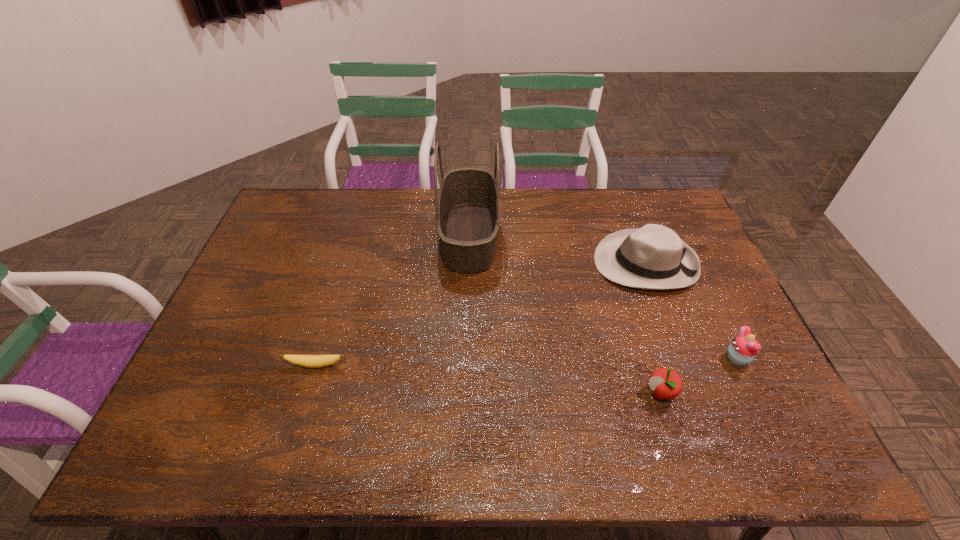
Find the location of a particular element. This screenshot has height=540, width=960. free region at the near edge of the desktop is located at coordinates (378, 439).

Where is `free location at the left edge of the desktop`? free location at the left edge of the desktop is located at coordinates (278, 237).

Where is `free region at the right edge of the desktop`? This screenshot has height=540, width=960. free region at the right edge of the desktop is located at coordinates (735, 409).

Identify the location of free space at the far left corner of the desktop. click(x=301, y=211).

In the image, there is a desktop. At what (x,y) coordinates should I click in order to perform the action: click on blank space at the far right corner. Please return your answer as a coordinate pair (x, y). Image resolution: width=960 pixels, height=540 pixels. Looking at the image, I should click on (668, 195).

Locate an element on the screen. vacant point located between the second object from left to right and the leftmost object is located at coordinates (393, 300).

At what (x,y) coordinates should I click in order to perform the action: click on vacant area between the fedora and the tallest object. Please return your answer as a coordinate pair (x, y). Looking at the image, I should click on (557, 249).

In order to click on vacant space that's between the cupcake and the tallest object in this screenshot , I will do [603, 296].

The height and width of the screenshot is (540, 960). I want to click on vacant space that is in between the fedora and the tallest object, so click(x=557, y=249).

This screenshot has height=540, width=960. I want to click on free point between the basket and the cupcake, so click(603, 296).